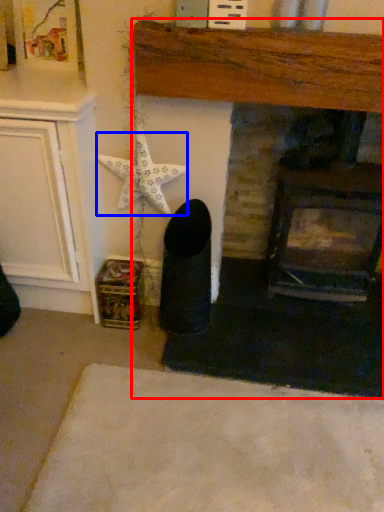
Question: Which object is closer to the camera taking this photo, fireplace (highlighted by a red box) or starfish (highlighted by a blue box)?

Choices:
 (A) fireplace
 (B) starfish

Answer: (A)